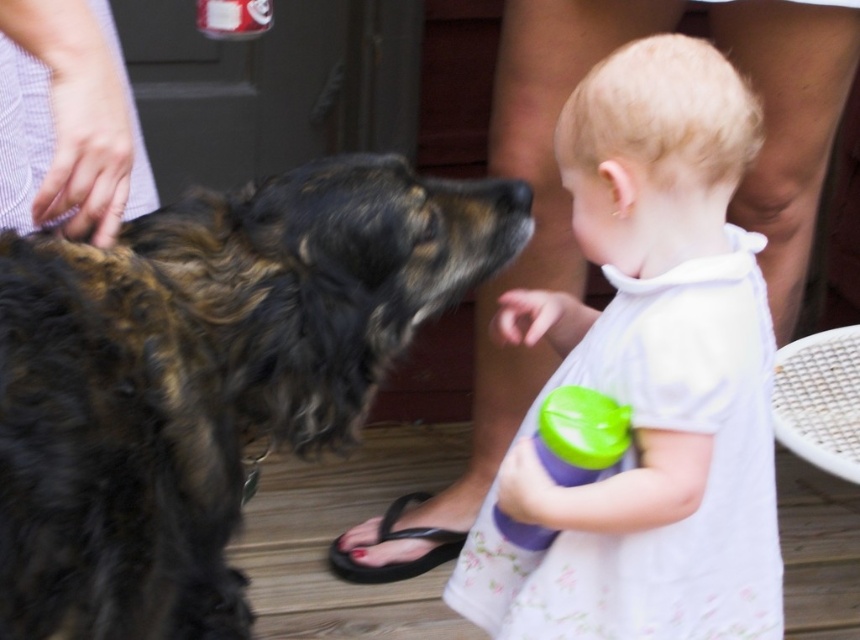
Question: Is white floral dress at center behind green plastic sippy cup at lower center?

Choices:
 (A) yes
 (B) no

Answer: (B)

Question: Is shaggy brown fur at center below white floral dress at center?

Choices:
 (A) yes
 (B) no

Answer: (B)

Question: Estimate the real-world distances between objects in this image. Which object is closer to the green plastic sippy cup at lower center?

Choices:
 (A) shaggy brown fur at center
 (B) white floral dress at center

Answer: (B)

Question: Which point is closer to the camera?

Choices:
 (A) (84, 493)
 (B) (564, 614)
 (C) (406, 570)
 (D) (578, 481)

Answer: (A)

Question: Is white floral dress at center thinner than green plastic sippy cup at lower center?

Choices:
 (A) no
 (B) yes

Answer: (A)

Question: Which object appears closest to the camera in this image?

Choices:
 (A) shaggy brown fur at center
 (B) green plastic sippy cup at lower center
 (C) black rubber sandal at lower center

Answer: (A)